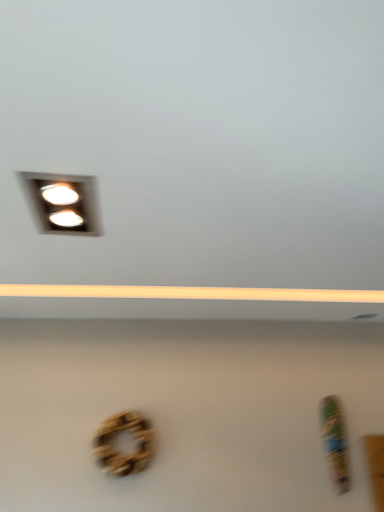
Question: Looking at their shapes, would you say wooden wreath at center is wider or thinner than matte white recessed lights at upper left?

Choices:
 (A) wide
 (B) thin

Answer: (B)

Question: From their relative heights in the image, would you say wooden wreath at center is taller or shorter than matte white recessed lights at upper left?

Choices:
 (A) tall
 (B) short

Answer: (A)

Question: Is wooden wreath at center spatially inside matte white recessed lights at upper left, or outside of it?

Choices:
 (A) inside
 (B) outside

Answer: (B)

Question: Is matte white recessed lights at upper left to the left or to the right of wooden wreath at center in the image?

Choices:
 (A) left
 (B) right

Answer: (A)

Question: In terms of width, does matte white recessed lights at upper left look wider or thinner when compared to wooden wreath at center?

Choices:
 (A) wide
 (B) thin

Answer: (A)

Question: Does point (69, 185) appear closer or farther from the camera than point (109, 417)?

Choices:
 (A) closer
 (B) farther

Answer: (A)

Question: From the image's perspective, is matte white recessed lights at upper left above or below wooden wreath at center?

Choices:
 (A) above
 (B) below

Answer: (A)